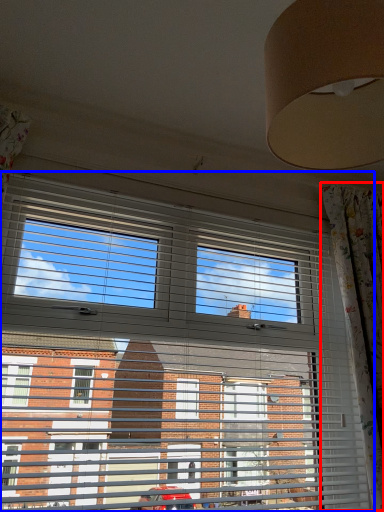
Question: Which object appears farthest to the camera in this image, curtain (highlighted by a red box) or window (highlighted by a blue box)?

Choices:
 (A) curtain
 (B) window

Answer: (A)